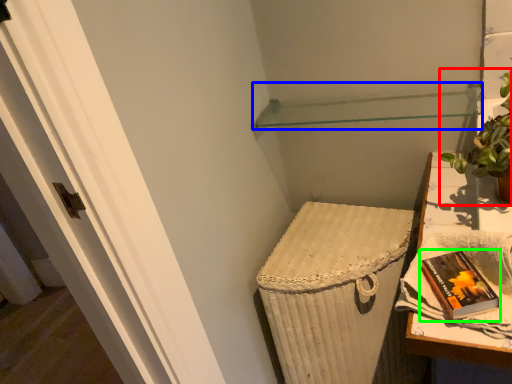
Question: Which object is positioned farthest from houseplant (highlighted by a red box)? Select from shelf (highlighted by a blue box) and paperback book (highlighted by a green box).

Choices:
 (A) shelf
 (B) paperback book

Answer: (A)